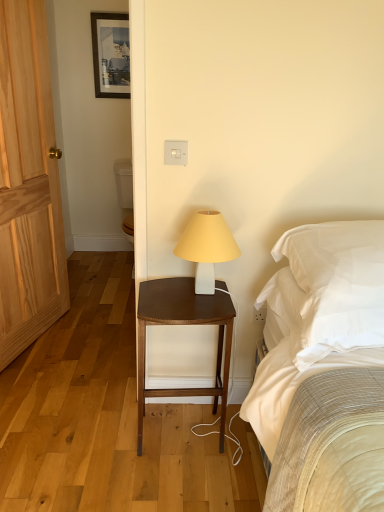
I want to click on free space below white matte lamp at center (from a real-world perspective), so [x=206, y=294].